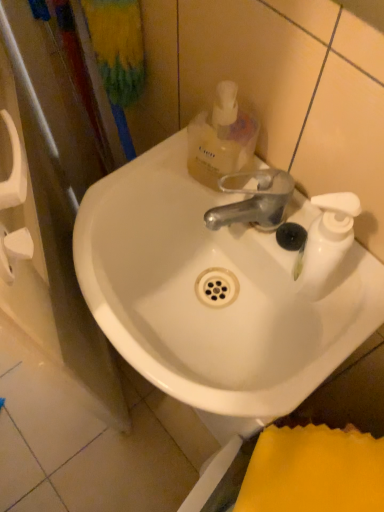
Question: Is white glossy sink at center in front of or behind translucent plastic mouthwash at upper center in the image?

Choices:
 (A) behind
 (B) front

Answer: (B)

Question: Considering the positions of white glossy sink at center and translucent plastic mouthwash at upper center in the image, is white glossy sink at center bigger or smaller than translucent plastic mouthwash at upper center?

Choices:
 (A) big
 (B) small

Answer: (A)

Question: Which is correct: white glossy sink at center is inside translucent plastic mouthwash at upper center, or outside of it?

Choices:
 (A) outside
 (B) inside

Answer: (A)

Question: Is translucent plastic mouthwash at upper center wider or thinner than white glossy sink at center?

Choices:
 (A) thin
 (B) wide

Answer: (A)

Question: Is point (248, 157) positioned closer to the camera than point (155, 244)?

Choices:
 (A) farther
 (B) closer

Answer: (B)

Question: Is translucent plastic mouthwash at upper center bigger or smaller than white glossy sink at center?

Choices:
 (A) big
 (B) small

Answer: (B)

Question: From the image's perspective, is translucent plastic mouthwash at upper center above or below white glossy sink at center?

Choices:
 (A) below
 (B) above

Answer: (B)